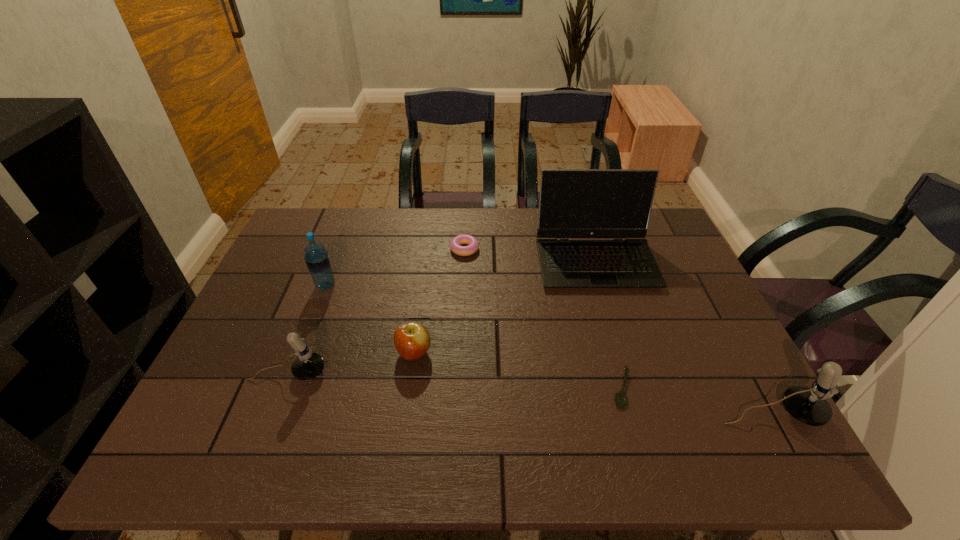
This screenshot has width=960, height=540. Find the location of `soupspoon that is positioned at the near edge`. soupspoon that is positioned at the near edge is located at coordinates (621, 399).

This screenshot has width=960, height=540. In order to click on microphone situated at the left edge in this screenshot , I will do `click(308, 365)`.

I want to click on water bottle located in the left edge section of the desktop, so click(x=317, y=259).

The width and height of the screenshot is (960, 540). What are the coordinates of `microphone present at the right edge` in the screenshot? It's located at [809, 406].

The width and height of the screenshot is (960, 540). In order to click on laptop computer that is positioned at the right edge in this screenshot , I will do `click(574, 203)`.

Locate an element on the screen. object that is at the near left corner is located at coordinates (308, 365).

You are a GUI agent. You are given a task and a screenshot of the screen. Output one action in this format:
    pyautogui.click(x=<x>, y=<y>)
    Task: Click on the object present at the far right corner
    
    Given the screenshot: What is the action you would take?
    pyautogui.click(x=574, y=203)

Where is `object that is at the near right corner`? This screenshot has height=540, width=960. object that is at the near right corner is located at coordinates (809, 406).

Locate an element on the screen. This screenshot has height=540, width=960. vacant space at the far edge of the desktop is located at coordinates (503, 228).

Where is `free space at the near edge of the desktop`? The height and width of the screenshot is (540, 960). free space at the near edge of the desktop is located at coordinates (306, 403).